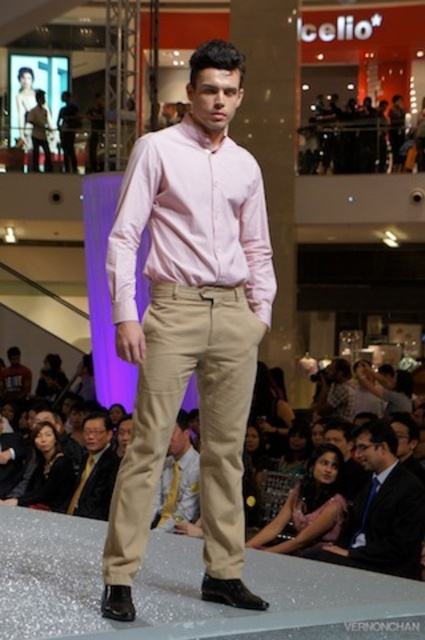
You are a photographer at the fashion show. You want to capture a clear photo of the pink smooth dress shirt at center without the satin pink blouse at center appearing in the background. Is this possible?

Yes, since the pink smooth dress shirt at center is in front of the satin pink blouse at center, you can focus the camera on the pink smooth dress shirt at center to exclude the satin pink blouse at center from the frame.

You are a photographer standing at the back of the runway. You want to capture a closeup shot of the beige cotton pants at center. Given that your camera has a maximum zoom range of 10 meters, will you be able to get a clear closeup?

The beige cotton pants at center and viewer are 28.19 meters apart. Since the camera can only zoom up to 10 meters, you cannot get a clear closeup as the distance exceeds the maximum zoom range.

You are a photographer positioned at the origin point of the coordinate system. You need to capture a photo of the matte khaki pants at center. What are the coordinates where you should aim your camera?

The coordinates to aim the camera are at point (189,323).